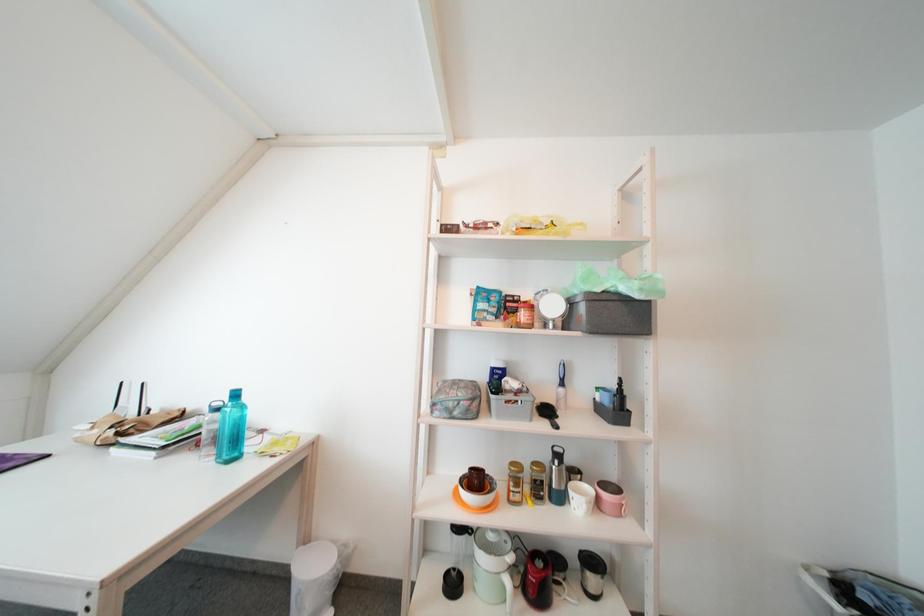
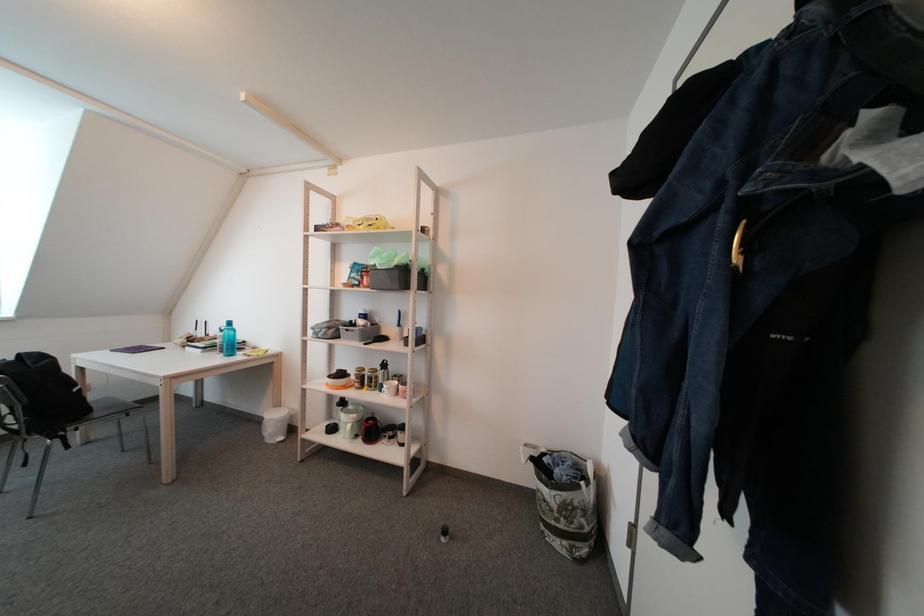
The images are taken continuously from a first-person perspective. In which direction are you moving?

The cameraman walked toward right, backward.